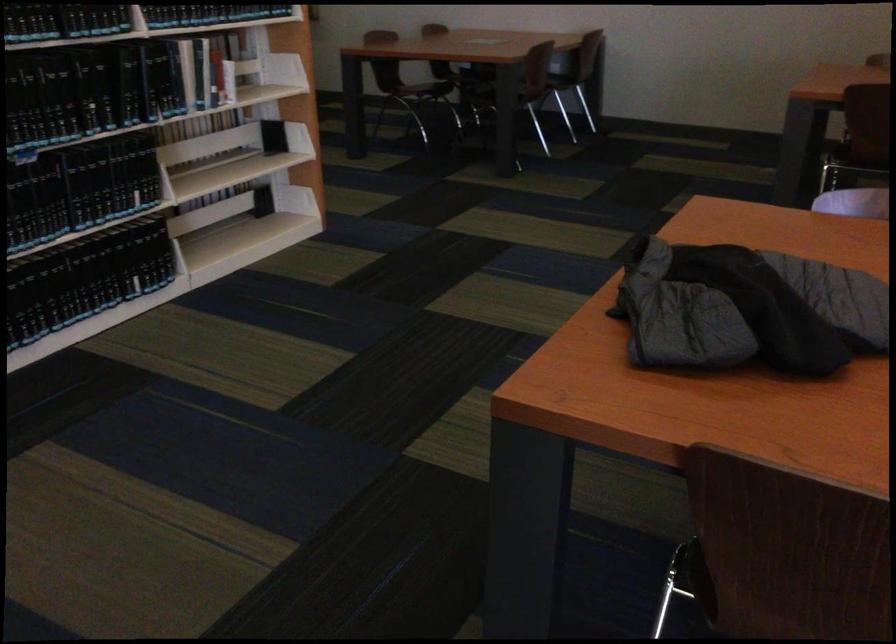
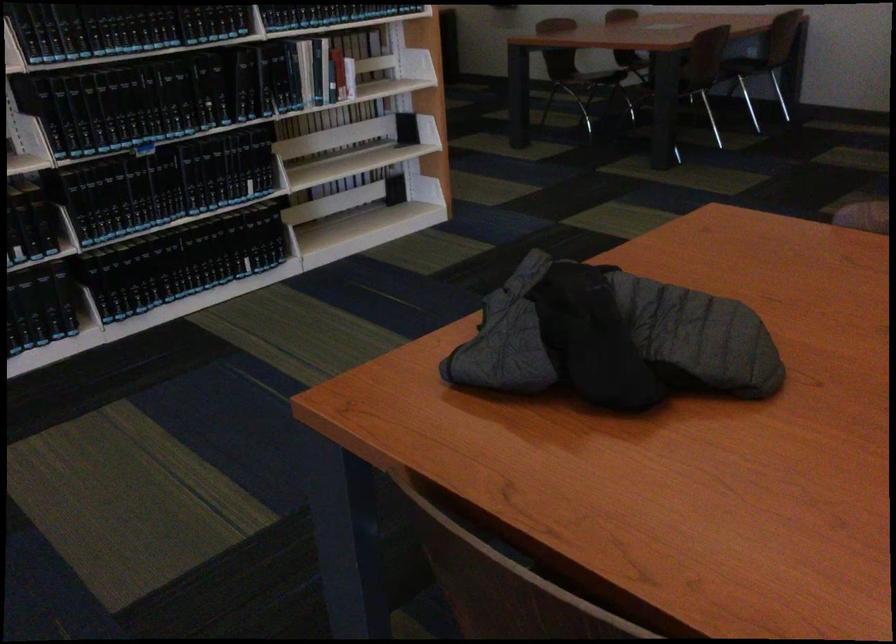
Locate, in the second image, the point that corresponds to the point at 71,279 in the first image.

(183, 261)